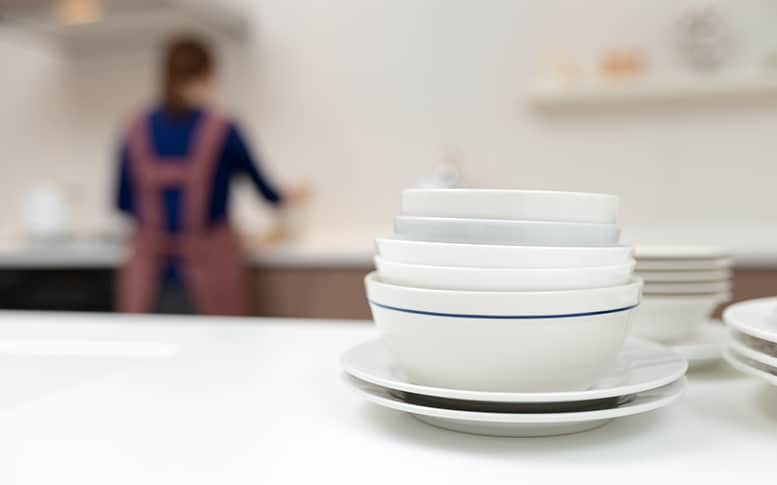
Find the location of `plate`. plate is located at coordinates (594, 416), (626, 384), (757, 374), (767, 360), (765, 333), (692, 318), (705, 290), (709, 275), (716, 267), (709, 255).